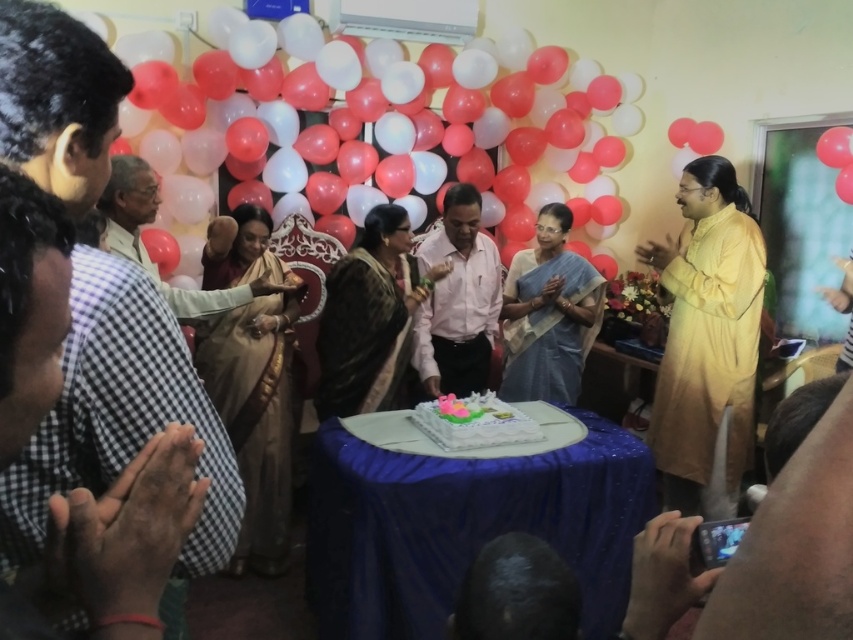
Question: Is satin beige saree at center positioned behind pink shirt at center?

Choices:
 (A) no
 (B) yes

Answer: (A)

Question: Which object appears farthest from the camera in this image?

Choices:
 (A) blue satin table at center
 (B) white matte balloons at upper center

Answer: (B)

Question: Can you confirm if blue silk saree at center is positioned to the left of white frosted cake at center?

Choices:
 (A) yes
 (B) no

Answer: (B)

Question: Based on their relative distances, which object is nearer to the blue silk saree at center?

Choices:
 (A) white frosted cake at center
 (B) blue satin table at center
 (C) light brown fabric saree at center

Answer: (A)

Question: Which is farther from the blue satin table at center?

Choices:
 (A) pink shirt at center
 (B) white matte balloons at upper center
 (C) dark brown silk saree at center

Answer: (B)

Question: Does blue silk saree at center come behind pink shirt at center?

Choices:
 (A) no
 (B) yes

Answer: (B)